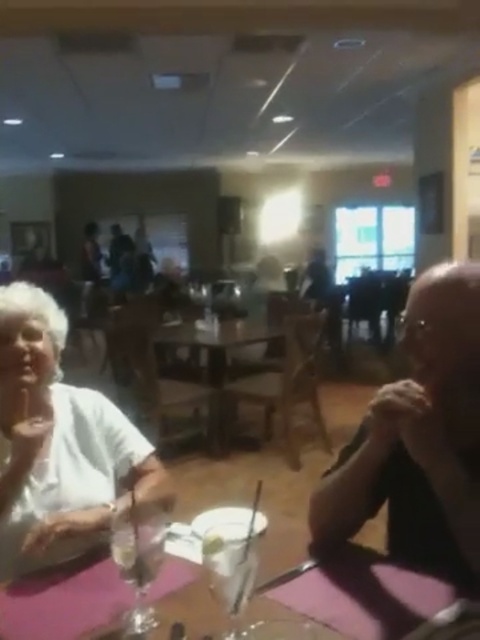
You are sitting at the wooden table at center and want to hand a napkin to the person wearing the smooth black shirt at right. Can you reach them directly without moving from your seat?

The smooth black shirt at right is closer to the viewer than the wooden table at center, so the person is closer to you. Therefore, you can reach them directly without moving from your seat.

You are a photographer trying to capture a candid shot of the smooth black shirt at right and the wooden table at center. Since you want to focus on the shirt, which object should you position closer to the camera?

The smooth black shirt at right should be positioned closer to the camera because it is already above the wooden table at center, making it naturally closer to the camera perspective.

From the picture: You are a photographer setting up for an event. You notice the white matte shirt at left and the wooden table at center in your frame. Which object should you adjust your camera angle to focus on if you want to capture the taller object?

The wooden table at center is taller than the white matte shirt at left, so you should adjust your camera angle to focus on the wooden table at center to capture the taller object.